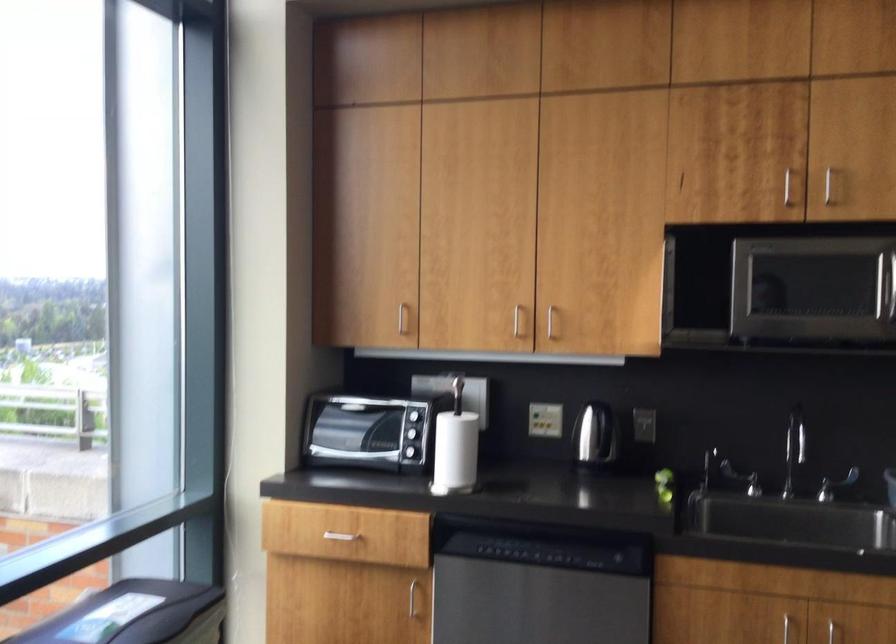
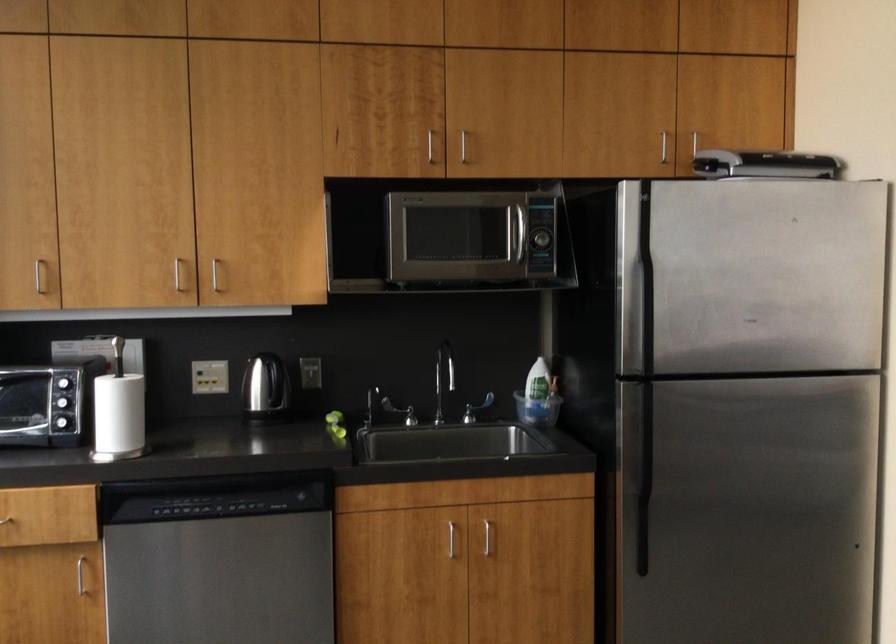
Question: I am providing you with two images of the same scene from different viewpoints. Which of the following objects are not visible in image2?

Choices:
 (A) large black stapler
 (B) silver electric kettle
 (C) white paper towel roll
 (D) none of these

Answer: (D)